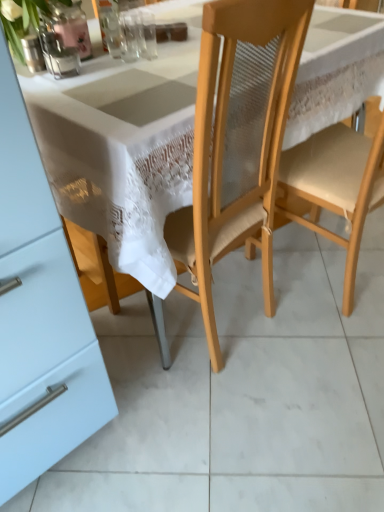
Question: Can you see light wood chair at center, the 2th chair in the left-to-right sequence, touching matte glass vase at upper left, the third tableware viewed from the right?

Choices:
 (A) no
 (B) yes

Answer: (A)

Question: From the image's perspective, does light wood chair at center, the 2th chair in the left-to-right sequence, appear higher than matte glass vase at upper left, the third tableware viewed from the right?

Choices:
 (A) yes
 (B) no

Answer: (B)

Question: Does light wood chair at center, the 2th chair in the left-to-right sequence, appear on the left side of matte glass vase at upper left, which is counted as the first tableware, starting from the left?

Choices:
 (A) no
 (B) yes

Answer: (A)

Question: Is light wood chair at center, the 1th chair when ordered from right to left, shorter than matte glass vase at upper left, which is counted as the first tableware, starting from the left?

Choices:
 (A) yes
 (B) no

Answer: (B)

Question: From the image's perspective, is light wood chair at center, the 1th chair when ordered from right to left, located beneath matte glass vase at upper left, which is counted as the first tableware, starting from the left?

Choices:
 (A) no
 (B) yes

Answer: (B)

Question: Is clear glass vase at upper center, the second tableware from the right, inside the boundaries of matte glass vase at upper left, which is counted as the first tableware, starting from the left, or outside?

Choices:
 (A) outside
 (B) inside

Answer: (A)

Question: From the image's perspective, relative to matte glass vase at upper left, which is counted as the first tableware, starting from the left, is clear glass vase at upper center, the second tableware from the right, above or below?

Choices:
 (A) below
 (B) above

Answer: (B)

Question: Considering the positions of point (100, 0) and point (33, 60), is point (100, 0) closer or farther from the camera than point (33, 60)?

Choices:
 (A) closer
 (B) farther

Answer: (B)

Question: From a real-world perspective, is clear glass vase at upper center, the second tableware from the right, physically located above or below matte glass vase at upper left, the third tableware viewed from the right?

Choices:
 (A) below
 (B) above

Answer: (B)

Question: Is clear glass vase at upper center, the 2th tableware when ordered from left to right, inside the boundaries of light wood chair at center, the 1th chair when ordered from right to left, or outside?

Choices:
 (A) inside
 (B) outside

Answer: (B)

Question: In terms of width, does clear glass vase at upper center, the 2th tableware when ordered from left to right, look wider or thinner when compared to light wood chair at center, the 1th chair when ordered from right to left?

Choices:
 (A) thin
 (B) wide

Answer: (A)

Question: From a real-world perspective, is clear glass vase at upper center, the 2th tableware when ordered from left to right, physically located above or below light wood chair at center, the 1th chair when ordered from right to left?

Choices:
 (A) above
 (B) below

Answer: (A)

Question: From the image's perspective, is clear glass vase at upper center, the second tableware from the right, positioned above or below light wood chair at center, the 1th chair when ordered from right to left?

Choices:
 (A) below
 (B) above

Answer: (B)

Question: Choose the correct answer: Is light wood chair at center, the 1th chair when ordered from right to left, inside clear glass vase at upper center, the second tableware from the right, or outside it?

Choices:
 (A) outside
 (B) inside

Answer: (A)

Question: Is light wood chair at center, the 1th chair when ordered from right to left, wider or thinner than clear glass vase at upper center, the second tableware from the right?

Choices:
 (A) wide
 (B) thin

Answer: (A)